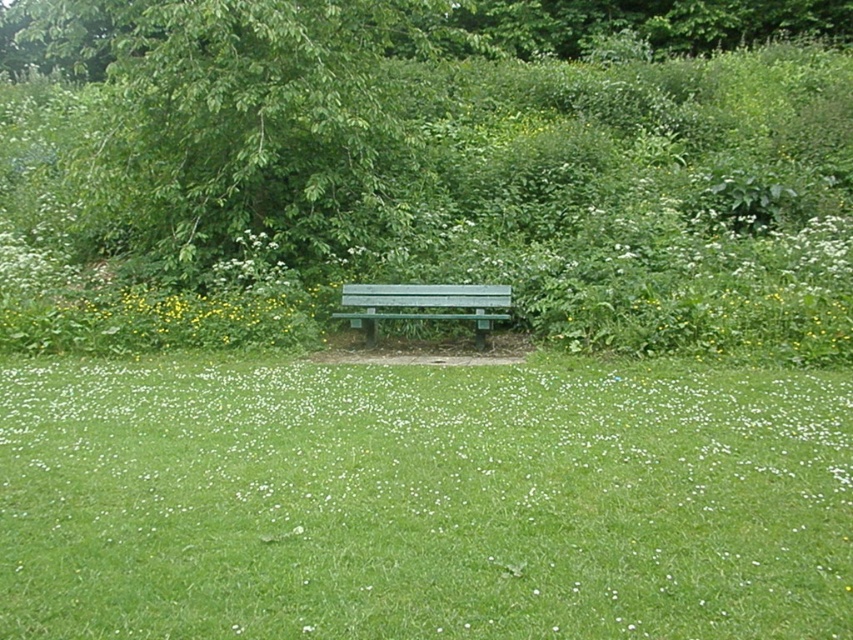
Between point (506, 563) and point (372, 304), which one is positioned behind?

Positioned behind is point (372, 304).

Find the location of a particular element. This screenshot has width=853, height=640. green grass at center is located at coordinates tap(422, 500).

Which is more to the left, green leafy tree at upper left or green painted wood bench at center?

From the viewer's perspective, green leafy tree at upper left appears more on the left side.

In the scene shown: Which is above, green leafy tree at upper left or green painted wood bench at center?

Positioned higher is green leafy tree at upper left.

Is point (399, 188) more distant than point (341, 317)?

That is True.

Find the location of a particular element. This screenshot has width=853, height=640. green leafy tree at upper left is located at coordinates (259, 125).

Between green grass at center and green leafy tree at upper left, which one is positioned higher?

green leafy tree at upper left is higher up.

Is green grass at center positioned behind green leafy tree at upper left?

That is False.

Is point (412, 595) in front of point (410, 129)?

Yes, point (412, 595) is in front of point (410, 129).

The width and height of the screenshot is (853, 640). I want to click on green grass at center, so click(422, 500).